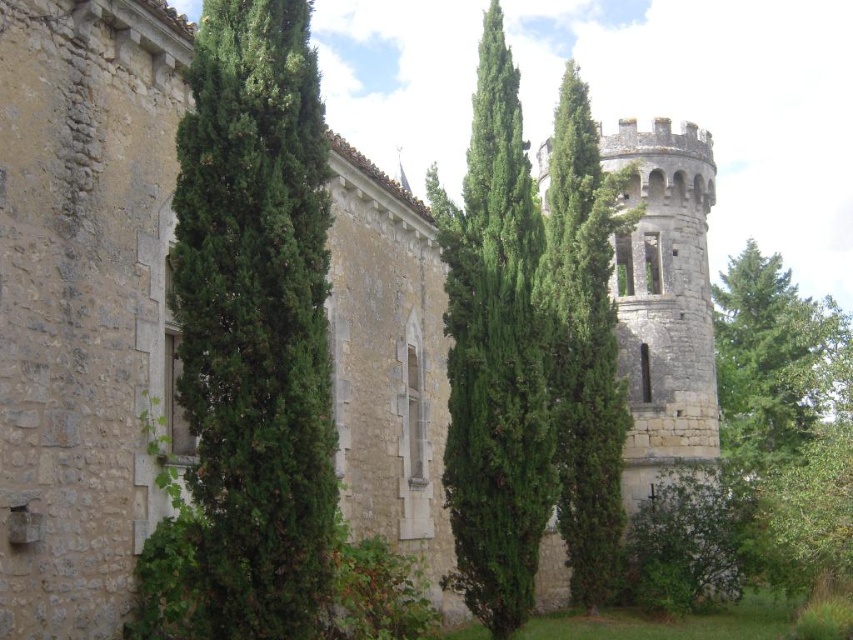
Question: Which object appears farthest from the camera in this image?

Choices:
 (A) green textured tree at center
 (B) green textured tree at left
 (C) green leafy tree at right

Answer: (C)

Question: Does green textured tree at left appear on the right side of green textured stone tower at center?

Choices:
 (A) no
 (B) yes

Answer: (A)

Question: Which object is the closest to the green textured tree at left?

Choices:
 (A) green leafy tree at right
 (B) green textured tree at center
 (C) green textured stone tower at center

Answer: (B)

Question: Can you confirm if green leafy tree at right is bigger than green textured stone tower at center?

Choices:
 (A) yes
 (B) no

Answer: (A)

Question: Which of the following is the farthest from the observer?

Choices:
 (A) green leafy tree at right
 (B) green textured tree at left
 (C) green textured tree at center
 (D) green textured stone tower at center

Answer: (A)

Question: Observing the image, what is the correct spatial positioning of green textured tree at center in reference to green textured stone tower at center?

Choices:
 (A) left
 (B) right

Answer: (A)